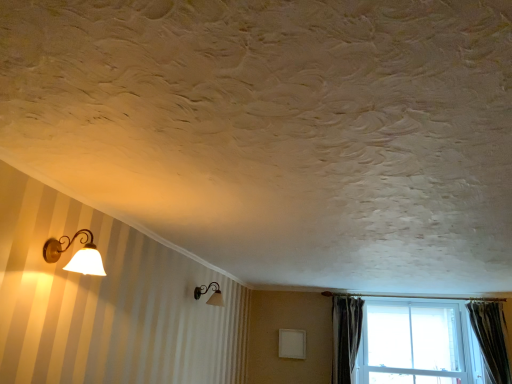
Question: Is white glass window at lower right to the left or to the right of dark gray velvet curtain at right, placed as the 2th curtain when sorted from right to left, in the image?

Choices:
 (A) left
 (B) right

Answer: (B)

Question: Considering the positions of point (434, 347) and point (338, 382), is point (434, 347) closer or farther from the camera than point (338, 382)?

Choices:
 (A) closer
 (B) farther

Answer: (A)

Question: Estimate the real-world distances between objects in this image. Which object is closer to the matte glass lamp at upper left, which is the 1th lamp from bottom to top?

Choices:
 (A) green textured curtain at right, the 2th curtain in the left-to-right sequence
 (B) white glass window at lower right
 (C) dark gray velvet curtain at right, which appears as the 1th curtain when viewed from the left
 (D) matte gold wall sconce at left, which is the 1th lamp in left-to-right order

Answer: (D)

Question: Estimate the real-world distances between objects in this image. Which object is farther from the green textured curtain at right, the 1th curtain viewed from the right?

Choices:
 (A) white glass window at lower right
 (B) dark gray velvet curtain at right, which appears as the 1th curtain when viewed from the left
 (C) matte gold wall sconce at left, which is the 2th lamp from right to left
 (D) matte glass lamp at upper left, which is the 1th lamp from back to front

Answer: (C)